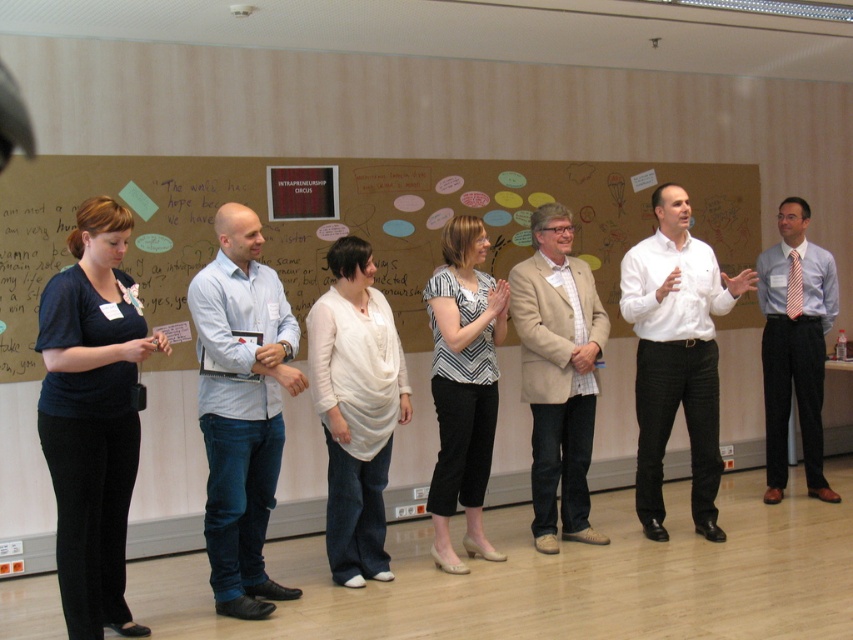
You are standing in the conference room and need to hand a document to the person wearing light blue denim jeans at center. If you are currently 3 meters away from them, can you reach them without moving closer?

The light blue denim jeans at center and viewer are 3.68 meters apart from each other. Since you are currently 3 meters away, you are still 0.68 meters too far to reach them without moving closer.

You are a photographer standing in the conference room. You want to take a photo of the light blue denim jeans at center and the striped jersey at center. Based on their positions, which one is closer to the camera?

The light blue denim jeans at center is positioned under the striped jersey at center, so the striped jersey at center is closer to the camera.

You are standing in the conference room and need to hand a document to the person wearing the white shirt at center without disturbing the person in front of them. Which direction should you move to avoid the light blue denim jeans at center?

You should move around the light blue denim jeans at center to the side where the white shirt at center is visible, as the light blue denim jeans at center is in front of the white shirt at center and blocking access directly.